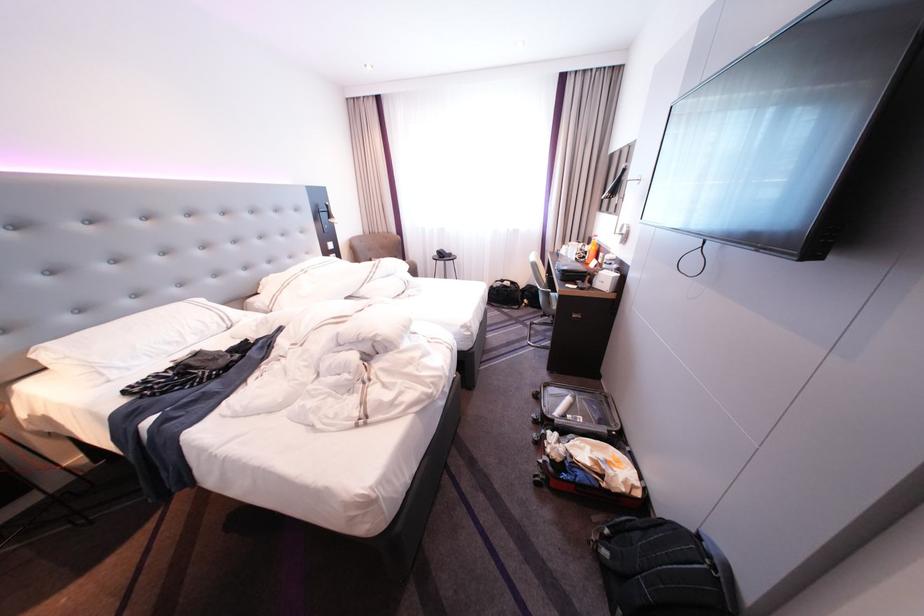
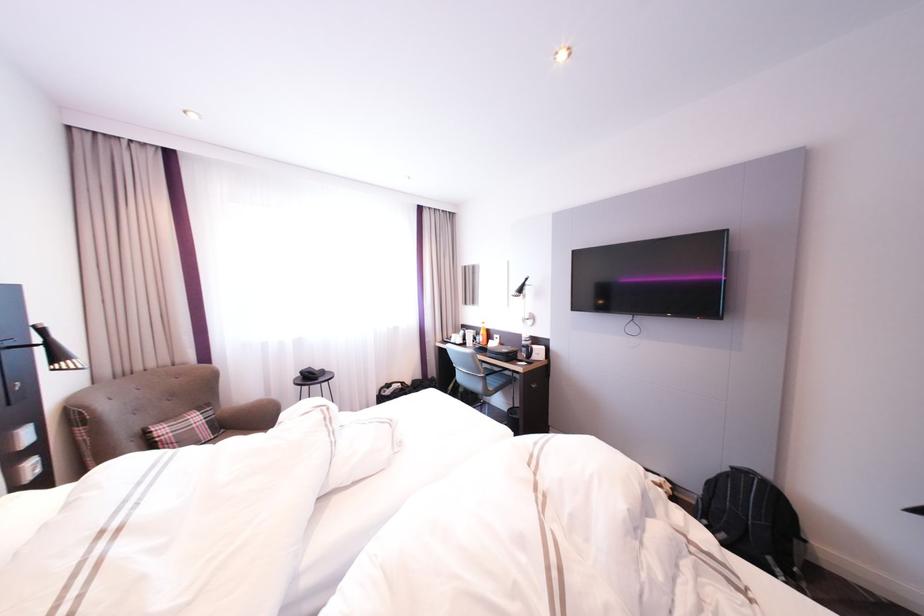
The point at [344,243] is marked in the first image. Where is the corresponding point in the second image?

(43, 424)